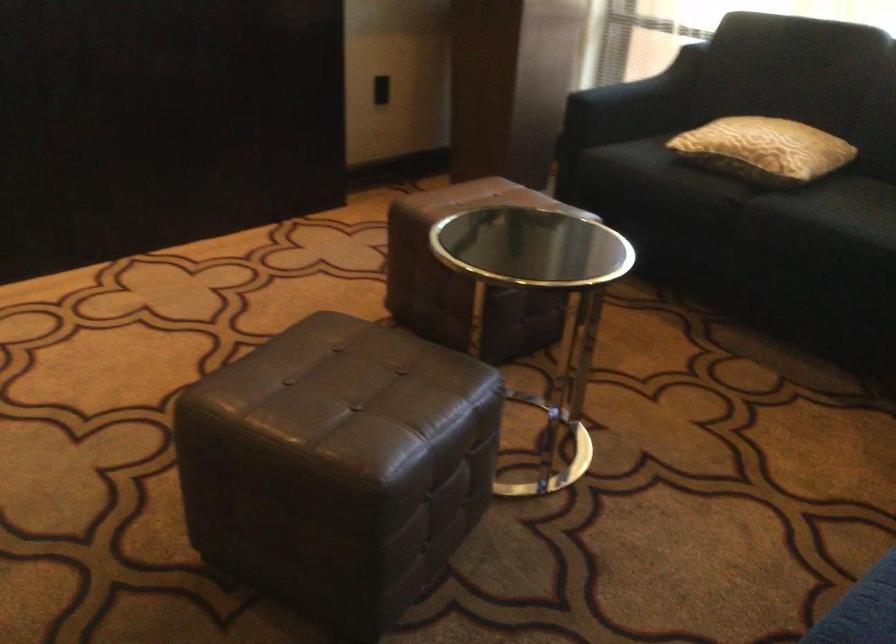
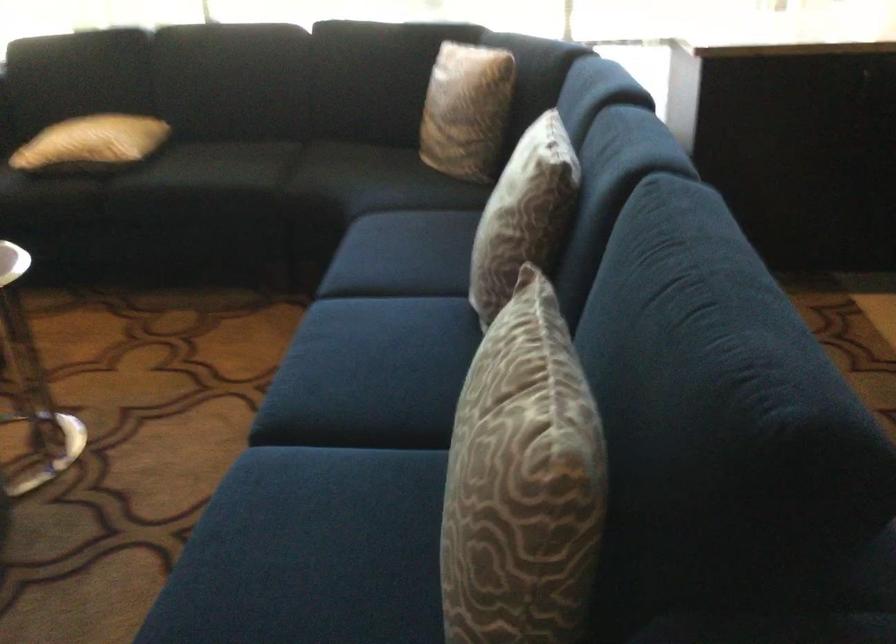
Question: How did the camera likely rotate?

Choices:
 (A) Left
 (B) Right
 (C) Up
 (D) Down

Answer: (B)